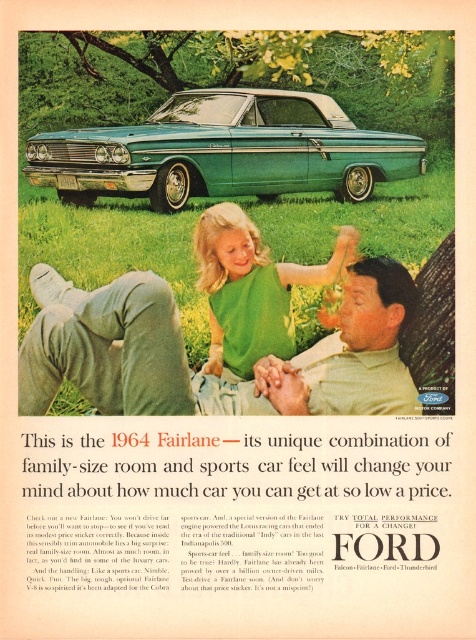
Which is more to the left, green fabric pants at lower left or green metallic car at center?

From the viewer's perspective, green fabric pants at lower left appears more on the left side.

Is green fabric pants at lower left taller than green metallic car at center?

No, green fabric pants at lower left is not taller than green metallic car at center.

Image resolution: width=476 pixels, height=640 pixels. Describe the element at coordinates (212, 376) in the screenshot. I see `green fabric pants at lower left` at that location.

What are the coordinates of `green fabric pants at lower left` in the screenshot? It's located at (212, 376).

Is point (351, 312) more distant than point (258, 330)?

No, it is not.

Is green fabric pants at lower left positioned behind green fabric shirt at center?

No, green fabric pants at lower left is in front of green fabric shirt at center.

Identify the location of green fabric pants at lower left. (212, 376).

Is green metallic car at center taller than green fabric shirt at center?

Yes.

Based on the photo, between green metallic car at center and green fabric shirt at center, which one appears on the right side from the viewer's perspective?

From the viewer's perspective, green metallic car at center appears more on the right side.

Who is more distant from viewer, [212,193] or [243,221]?

The point [212,193] is more distant.

The width and height of the screenshot is (476, 640). Identify the location of green metallic car at center. (224, 150).